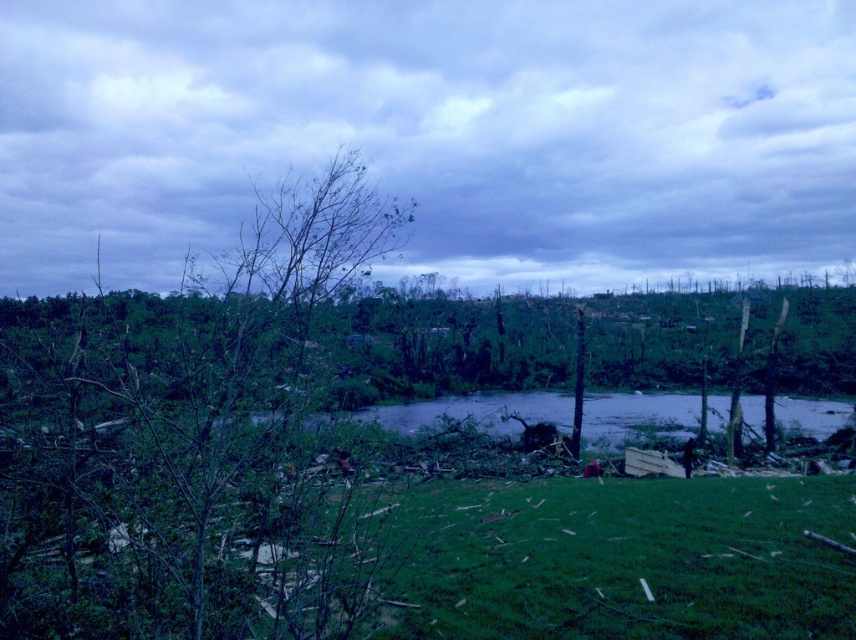
You are a rescue worker trying to cross the clear water at center to reach the green leafy tree at center. Can you safely walk across the water?

The green leafy tree at center is positioned over clear water at center, so the water is under the tree. Since water is not solid ground, you cannot safely walk across the clear water at center to reach the green leafy tree at center.

You are a rescue worker assessing the scene after a storm. You notice the green grass at lower center and the clear water at center. Which of these two areas is lower in height?

The green grass at lower center is shorter than the clear water at center, so the clear water at center is higher in height.

You are standing at the point marked as point (613,557) in the image. What type of terrain are you currently standing on?

The point (613,557) is on green grass at lower center, so you are standing on green grass.